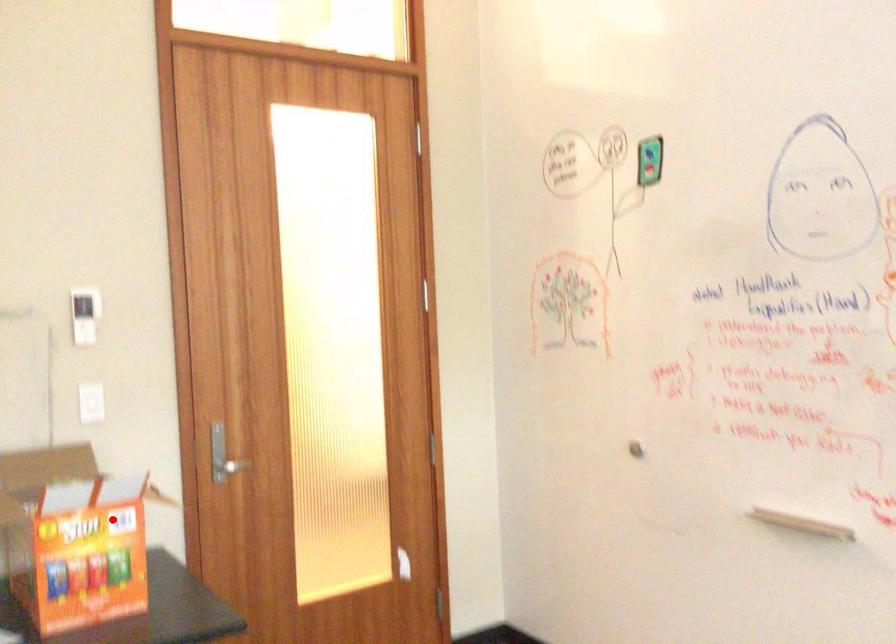
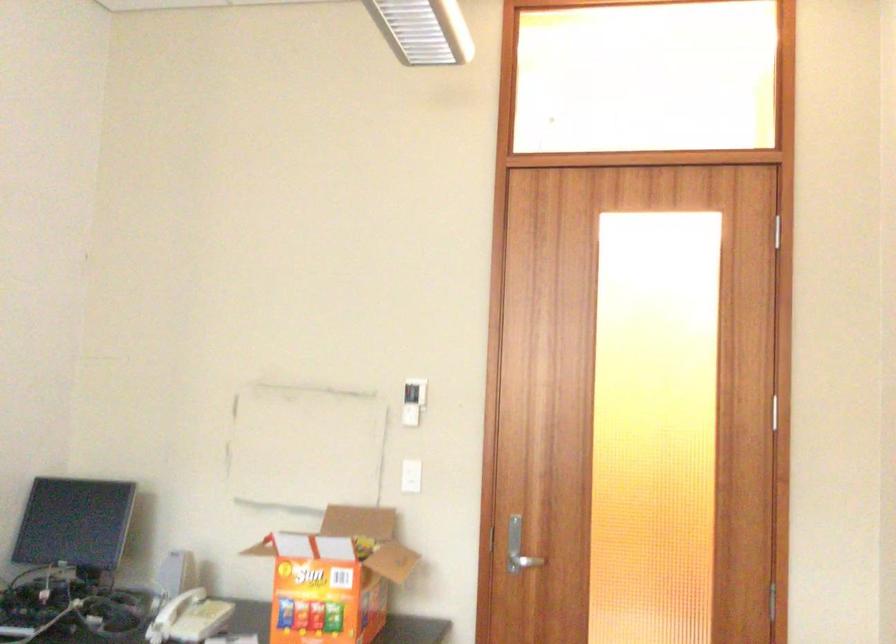
Find the pixel in the second image that matches the highlighted location in the first image.

(334, 576)